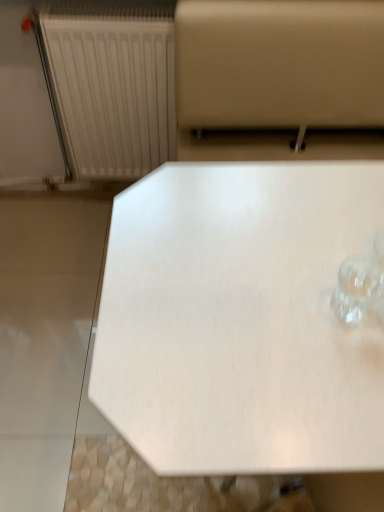
This screenshot has width=384, height=512. Find the location of `free space above white matte table at center (from a real-world perspective)`. free space above white matte table at center (from a real-world perspective) is located at coordinates (264, 277).